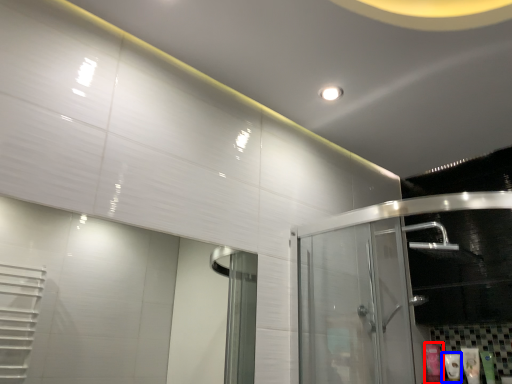
Question: Which of the following is the farthest to the observer, toiletry (highlighted by a red box) or toiletry (highlighted by a blue box)?

Choices:
 (A) toiletry
 (B) toiletry

Answer: (A)